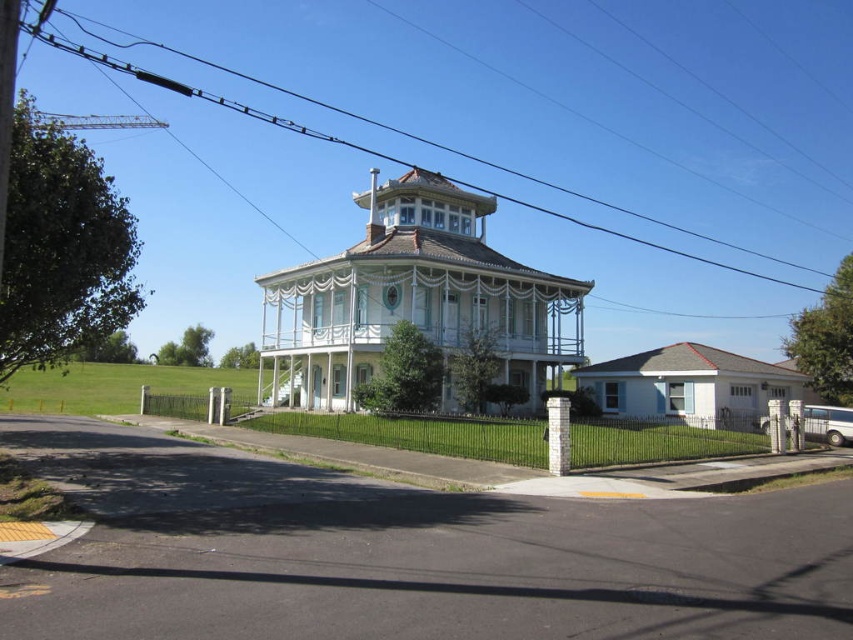
You are standing in front of the house and want to see the white stone column at center. Can you see it clearly through the black wire at upper center?

The white stone column at center is behind the black wire at upper center, so it might be partially obscured or less visible through the black wire at upper center.

You are a visitor approaching the house and notice two structures at the center of the entrance. Which one is taller between the white stone column at center and the white painted wood post at center?

The white stone column at center is taller than the white painted wood post at center.